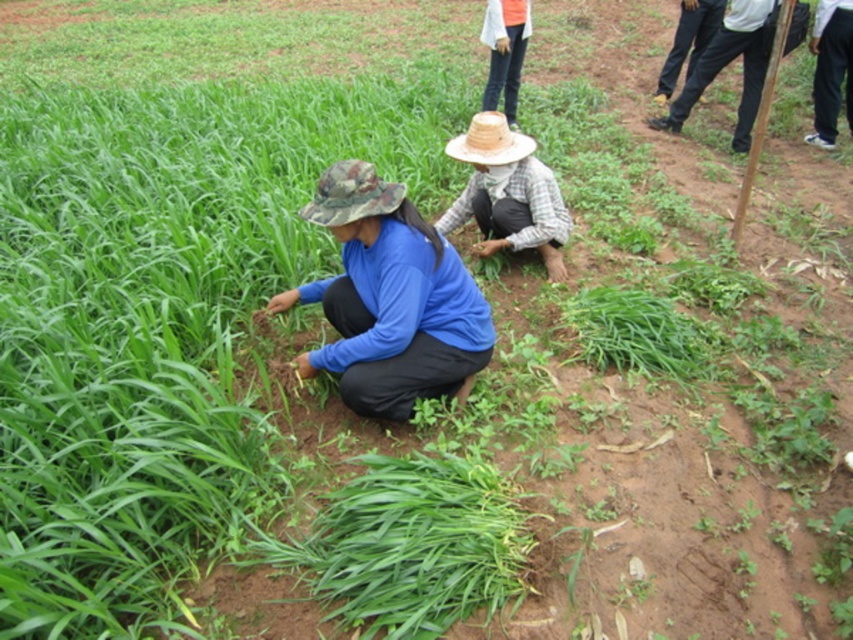
Is point (480, 241) positioned in front of point (326, 211)?

No, (480, 241) is behind (326, 211).

Does plaid fabric hat at center have a larger size compared to camo fabric hat at lower left?

Indeed, plaid fabric hat at center has a larger size compared to camo fabric hat at lower left.

Who is more distant from viewer, (567,216) or (332,180)?

Point (567,216)

I want to click on plaid fabric hat at center, so click(x=508, y=193).

The image size is (853, 640). What do you see at coordinates (389, 298) in the screenshot?
I see `blue matte shirt at center` at bounding box center [389, 298].

In the scene shown: Can you confirm if blue matte shirt at center is positioned above plaid fabric hat at center?

No, blue matte shirt at center is not above plaid fabric hat at center.

Find the location of a particular element. blue matte shirt at center is located at coordinates (389, 298).

Who is lower down, blue matte shirt at center or camo fabric hat at lower left?

blue matte shirt at center is lower down.

Is point (375, 401) behind point (381, 195)?

Yes, it is.

Locate an element on the screen. blue matte shirt at center is located at coordinates (389, 298).